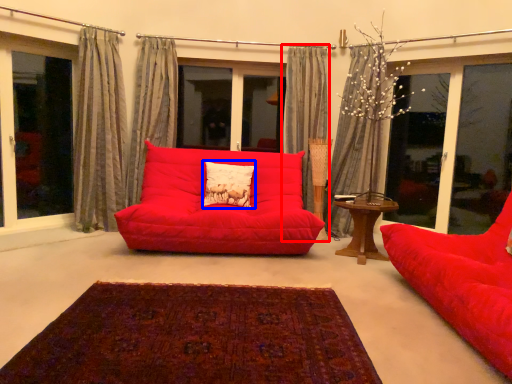
Question: Which of the following is the closest to the observer, curtain (highlighted by a red box) or pillow (highlighted by a blue box)?

Choices:
 (A) curtain
 (B) pillow

Answer: (B)